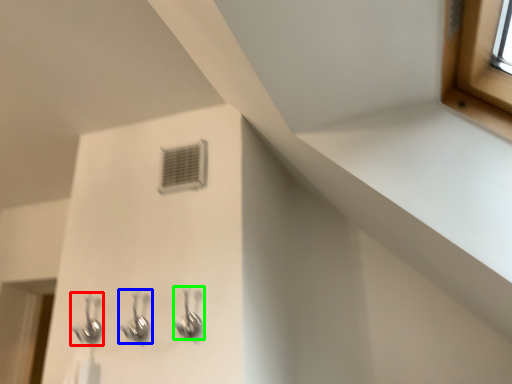
Question: Considering the real-world distances, which object is closest to plumbing fixture (highlighted by a red box)? plumbing fixture (highlighted by a blue box) or plumbing fixture (highlighted by a green box).

Choices:
 (A) plumbing fixture
 (B) plumbing fixture

Answer: (A)